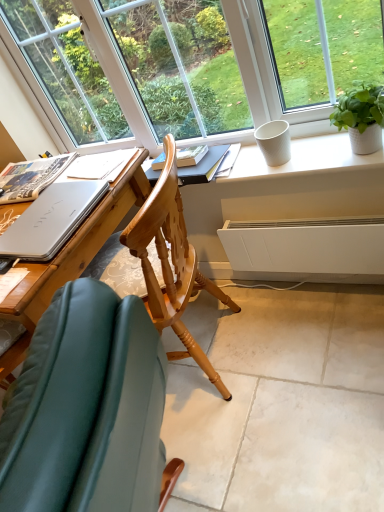
Question: Considering the positions of sleek silver laptop at left and wooden chair at center in the image, is sleek silver laptop at left taller or shorter than wooden chair at center?

Choices:
 (A) tall
 (B) short

Answer: (B)

Question: From the image's perspective, is sleek silver laptop at left positioned above or below wooden chair at center?

Choices:
 (A) above
 (B) below

Answer: (A)

Question: Which object is positioned closest to the white paper at left?

Choices:
 (A) wooden chair at center
 (B) sleek silver laptop at left
 (C) white ceramic pot at upper right

Answer: (B)

Question: Considering the real-world distances, which object is farthest from the white paper at left?

Choices:
 (A) white ceramic pot at upper right
 (B) sleek silver laptop at left
 (C) wooden chair at center

Answer: (A)